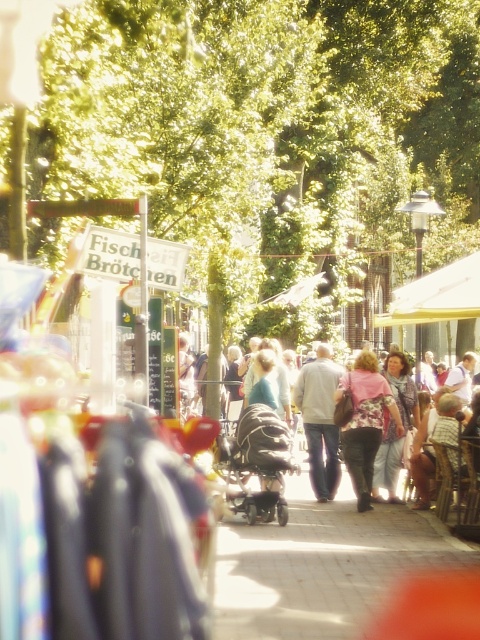
Based on the photo, does light gray sweater at center appear on the left side of light blue fabric dress at center?

Yes, light gray sweater at center is to the left of light blue fabric dress at center.

In the scene shown: Is light gray sweater at center taller than light blue fabric dress at center?

Yes, light gray sweater at center is taller than light blue fabric dress at center.

Locate an element on the screen. This screenshot has width=480, height=640. light gray sweater at center is located at coordinates (320, 419).

Can you confirm if blue denim jeans at center is positioned to the right of dark gray plastic baby carriage at center?

Yes, blue denim jeans at center is to the right of dark gray plastic baby carriage at center.

Does blue denim jeans at center come in front of dark gray plastic baby carriage at center?

No.

You are a GUI agent. You are given a task and a screenshot of the screen. Output one action in this format:
    pyautogui.click(x=<x>, y=<y>)
    Task: Click on the blue denim jeans at center
    The width and height of the screenshot is (480, 640).
    Given the screenshot: What is the action you would take?
    pyautogui.click(x=256, y=392)

The image size is (480, 640). In order to click on blue denim jeans at center in this screenshot , I will do `click(256, 392)`.

Is floral fabric blouse at center further to the viewer compared to light gray sweater at center?

No, floral fabric blouse at center is in front of light gray sweater at center.

Does point (351, 468) come farther from viewer compared to point (330, 444)?

That is False.

Is point (345, 451) closer to camera compared to point (325, 355)?

Yes.

Locate an element on the screen. floral fabric blouse at center is located at coordinates (365, 422).